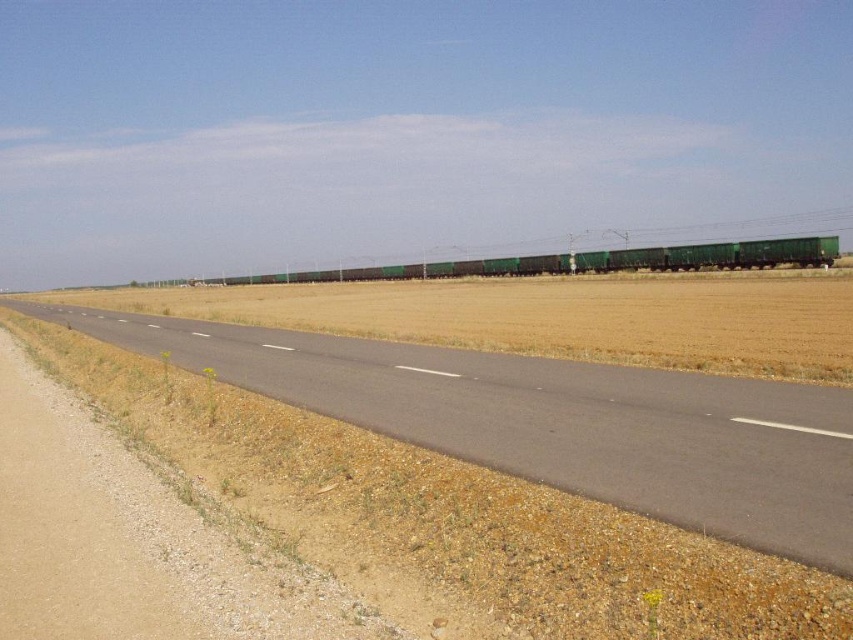
Is asphalt road at center to the left of green matte train carriages at center from the viewer's perspective?

In fact, asphalt road at center is to the right of green matte train carriages at center.

Who is more distant from viewer, [769,484] or [579,269]?

The point [579,269] is more distant.

What are the coordinates of `asphalt road at center` in the screenshot? It's located at (554, 420).

Does point (763, 496) come closer to viewer compared to point (714, 300)?

Yes, it is in front of point (714, 300).

Which of these two, asphalt road at center or brown grassland at center, stands shorter?

asphalt road at center is shorter.

Locate an element on the screen. The height and width of the screenshot is (640, 853). asphalt road at center is located at coordinates (554, 420).

Does brown grassland at center have a lesser width compared to green matte train carriages at center?

In fact, brown grassland at center might be wider than green matte train carriages at center.

Does brown grassland at center come behind green matte train carriages at center?

No, brown grassland at center is in front of green matte train carriages at center.

This screenshot has height=640, width=853. Find the location of `brown grassland at center`. brown grassland at center is located at coordinates (554, 316).